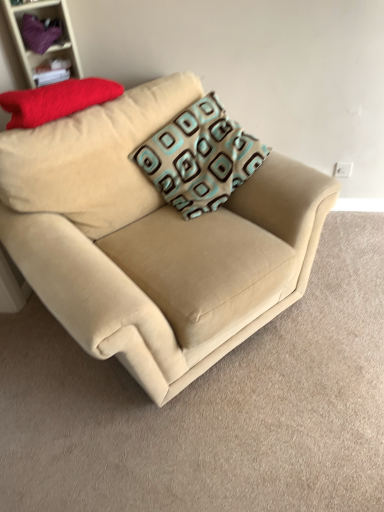
Question: From a real-world perspective, does matte purple fabric at upper left sit lower than matte red pillow at upper left, acting as the 2th pillow starting from the right?

Choices:
 (A) yes
 (B) no

Answer: (B)

Question: Is matte purple fabric at upper left further to the viewer compared to matte red pillow at upper left, acting as the 2th pillow starting from the right?

Choices:
 (A) yes
 (B) no

Answer: (A)

Question: From the image's perspective, is matte purple fabric at upper left under matte red pillow at upper left, acting as the 2th pillow starting from the right?

Choices:
 (A) no
 (B) yes

Answer: (A)

Question: Are matte purple fabric at upper left and matte red pillow at upper left, which appears as the 1th pillow when viewed from the left, making contact?

Choices:
 (A) yes
 (B) no

Answer: (B)

Question: Is matte red pillow at upper left, which appears as the 1th pillow when viewed from the left, surrounded by matte purple fabric at upper left?

Choices:
 (A) yes
 (B) no

Answer: (B)

Question: Is beige fabric couch at center spatially inside matte red pillow at upper left, acting as the 2th pillow starting from the right, or outside of it?

Choices:
 (A) inside
 (B) outside

Answer: (B)

Question: In terms of height, does beige fabric couch at center look taller or shorter compared to matte red pillow at upper left, acting as the 2th pillow starting from the right?

Choices:
 (A) short
 (B) tall

Answer: (B)

Question: From a real-world perspective, is beige fabric couch at center physically located above or below matte red pillow at upper left, which appears as the 1th pillow when viewed from the left?

Choices:
 (A) above
 (B) below

Answer: (B)

Question: In the image, is beige fabric couch at center positioned in front of or behind matte red pillow at upper left, acting as the 2th pillow starting from the right?

Choices:
 (A) behind
 (B) front

Answer: (B)

Question: From a real-world perspective, is matte red pillow at upper left, which appears as the 1th pillow when viewed from the left, positioned above or below matte purple fabric at upper left?

Choices:
 (A) below
 (B) above

Answer: (A)

Question: Would you say matte red pillow at upper left, which appears as the 1th pillow when viewed from the left, is to the left or to the right of matte purple fabric at upper left in the picture?

Choices:
 (A) right
 (B) left

Answer: (A)

Question: In terms of height, does matte red pillow at upper left, which appears as the 1th pillow when viewed from the left, look taller or shorter compared to matte purple fabric at upper left?

Choices:
 (A) short
 (B) tall

Answer: (A)

Question: In terms of size, does matte red pillow at upper left, acting as the 2th pillow starting from the right, appear bigger or smaller than matte purple fabric at upper left?

Choices:
 (A) small
 (B) big

Answer: (B)

Question: In terms of width, does teal-patterned cushion at center, the 2th pillow viewed from the left, look wider or thinner when compared to purple fabric at upper left?

Choices:
 (A) wide
 (B) thin

Answer: (A)

Question: Choose the correct answer: Is teal-patterned cushion at center, which is the first pillow from right to left, inside purple fabric at upper left or outside it?

Choices:
 (A) inside
 (B) outside

Answer: (B)